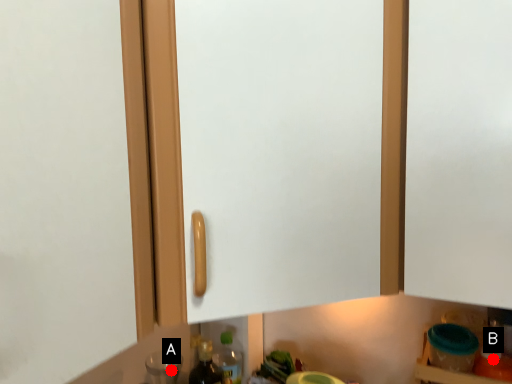
Question: Two points are circled on the image, labeled by A and B beside each circle. Which point appears closest to the camera in this image?

Choices:
 (A) A is closer
 (B) B is closer

Answer: (B)